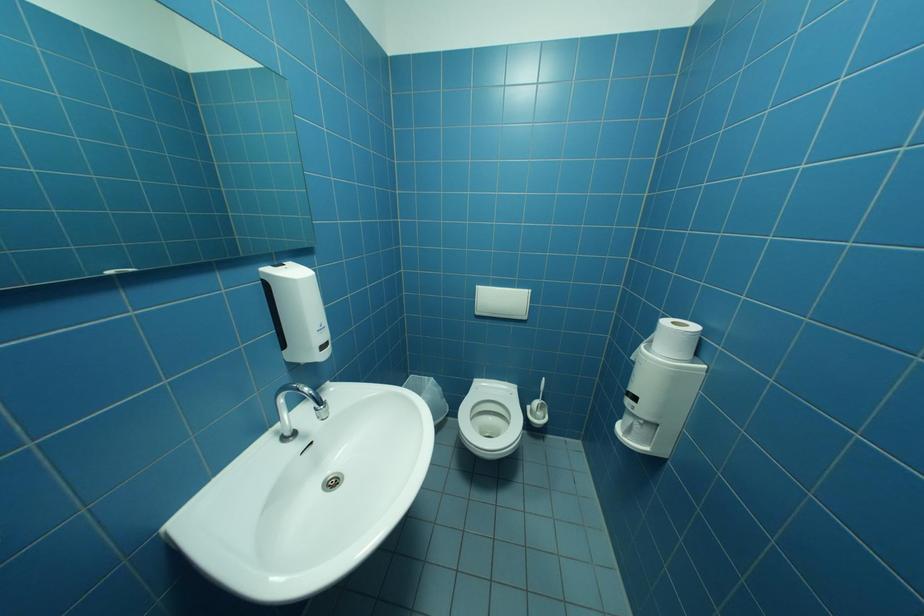
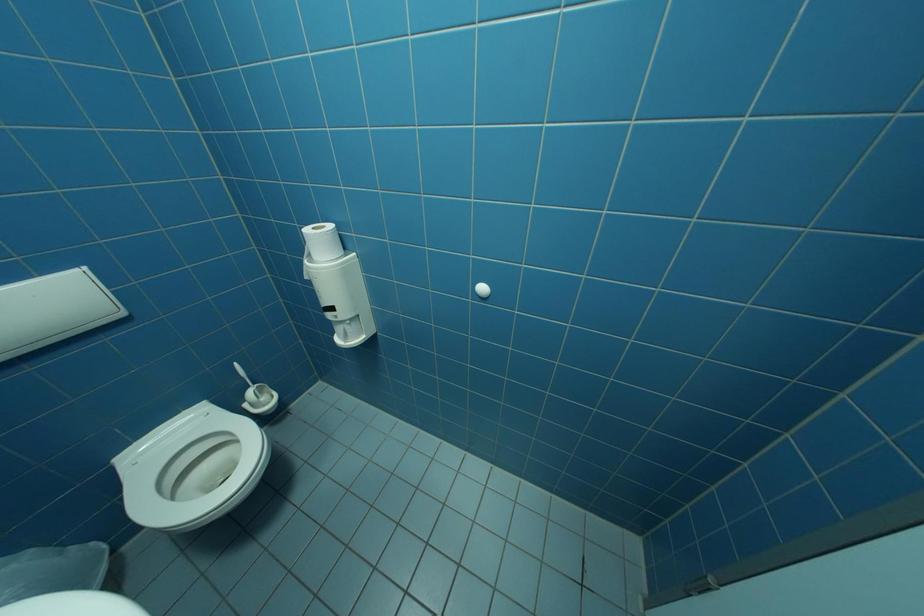
The images are taken continuously from a first-person perspective. In which direction is your viewpoint rotating?

The rotation direction of the camera is right-down.